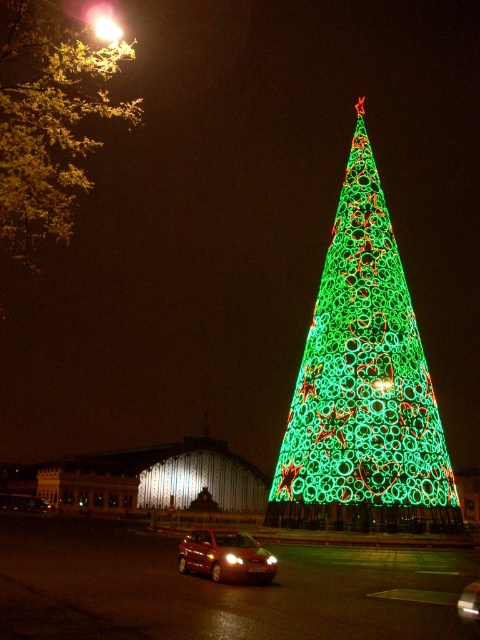
Does green illuminated christmas tree at center appear over matte red car at lower center?

Correct, green illuminated christmas tree at center is located above matte red car at lower center.

Can you confirm if green illuminated christmas tree at center is positioned to the right of matte red car at lower center?

Yes, green illuminated christmas tree at center is to the right of matte red car at lower center.

This screenshot has width=480, height=640. What do you see at coordinates (363, 387) in the screenshot?
I see `green illuminated christmas tree at center` at bounding box center [363, 387].

Where is `green illuminated christmas tree at center`? The width and height of the screenshot is (480, 640). green illuminated christmas tree at center is located at coordinates (363, 387).

Which is more to the right, green illuminated tree at upper center or matte red car at lower center?

matte red car at lower center is more to the right.

Between green illuminated tree at upper center and matte red car at lower center, which one has less height?

With less height is matte red car at lower center.

Is point (26, 116) closer to camera compared to point (238, 572)?

No, it is behind (238, 572).

Identify the location of green illuminated tree at upper center. The width and height of the screenshot is (480, 640). (48, 120).

What do you see at coordinates (48, 120) in the screenshot?
I see `green illuminated tree at upper center` at bounding box center [48, 120].

What are the coordinates of `green illuminated tree at upper center` in the screenshot? It's located at (48, 120).

Find the location of a particular element. The width and height of the screenshot is (480, 640). green illuminated tree at upper center is located at coordinates (48, 120).

You are a GUI agent. You are given a task and a screenshot of the screen. Output one action in this format:
    pyautogui.click(x=<x>, y=<y>)
    Task: Click on the green illuminated tree at upper center
    This screenshot has width=480, height=640.
    Given the screenshot: What is the action you would take?
    pyautogui.click(x=48, y=120)